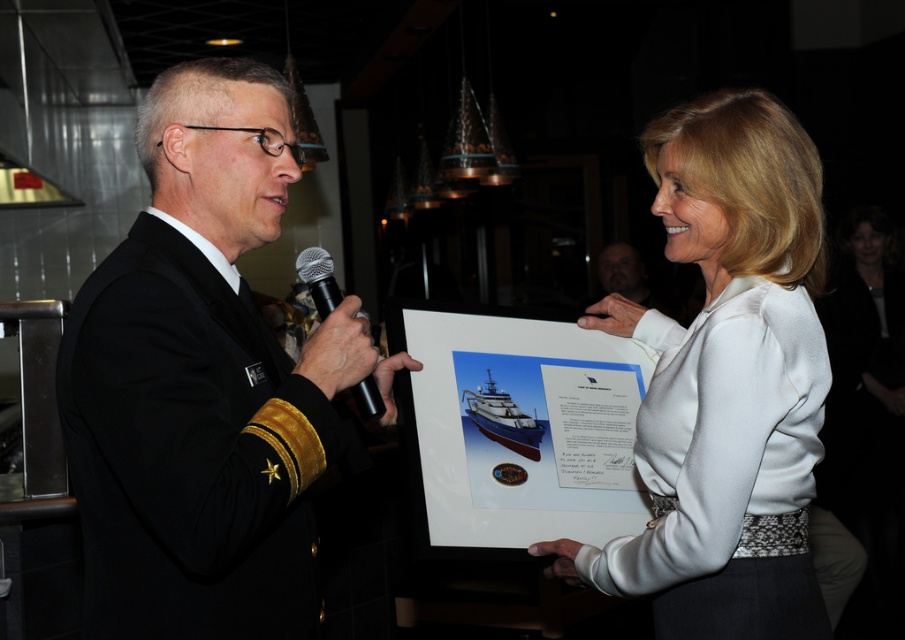
Question: Which of the following is the closest to the observer?

Choices:
 (A) click(160, 484)
 (B) click(816, 369)
 (C) click(373, 404)

Answer: (A)

Question: Which point appears farthest from the camera in this image?

Choices:
 (A) (329, 356)
 (B) (614, 243)
 (C) (780, 625)

Answer: (B)

Question: Considering the relative positions of black metallic microphone at center and dark brown leather jacket at upper center in the image provided, where is black metallic microphone at center located with respect to dark brown leather jacket at upper center?

Choices:
 (A) left
 (B) right

Answer: (A)

Question: Is white satin blouse at center to the right of dark brown leather jacket at upper center from the viewer's perspective?

Choices:
 (A) no
 (B) yes

Answer: (A)

Question: Which object appears farthest from the camera in this image?

Choices:
 (A) white satin blouse at center
 (B) black metallic microphone at center

Answer: (B)

Question: Does black uniform at left have a smaller size compared to white satin blouse at center?

Choices:
 (A) no
 (B) yes

Answer: (A)